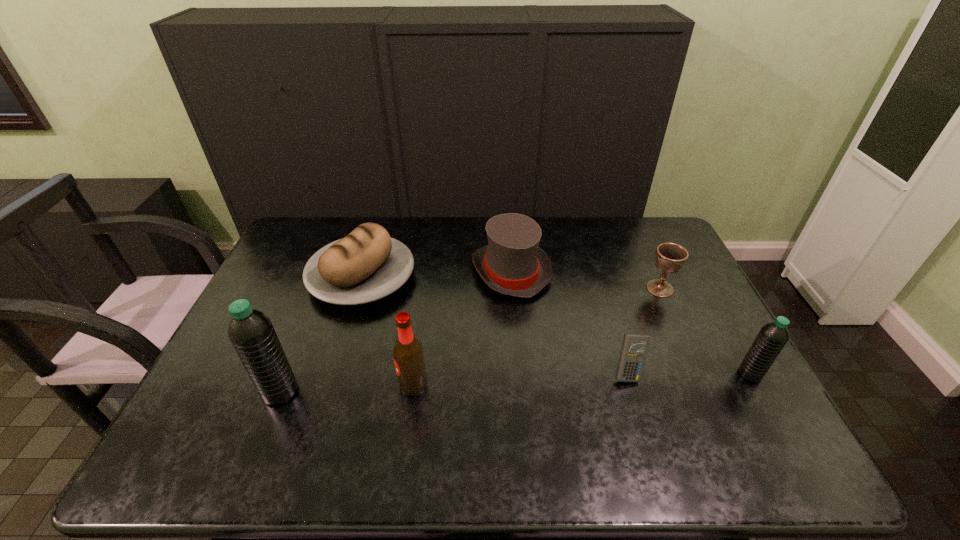
Where is `water bottle that is at the near edge`? Image resolution: width=960 pixels, height=540 pixels. water bottle that is at the near edge is located at coordinates click(251, 332).

Where is `beer bottle at the near edge`? beer bottle at the near edge is located at coordinates pyautogui.click(x=408, y=354).

Where is `water bottle that is positioned at the left edge`? water bottle that is positioned at the left edge is located at coordinates (251, 332).

The height and width of the screenshot is (540, 960). What are the coordinates of `bread present at the left edge` in the screenshot? It's located at (366, 265).

Find the location of a particular element. water bottle that is at the right edge is located at coordinates (773, 336).

You are a GUI agent. You are given a task and a screenshot of the screen. Output one action in this format:
    pyautogui.click(x=<x>, y=<y>)
    Task: Click on the chalice that is positioned at the right edge
    This screenshot has width=960, height=540.
    Given the screenshot: What is the action you would take?
    pyautogui.click(x=670, y=257)

Identify the location of object that is at the far left corner. The height and width of the screenshot is (540, 960). (366, 265).

At what (x,y) coordinates should I click in order to perform the action: click on object present at the near left corner. Please return your answer as a coordinate pair (x, y). The width and height of the screenshot is (960, 540). Looking at the image, I should click on (251, 332).

I want to click on blank space at the far edge of the desktop, so click(x=484, y=230).

Where is `vacant area at the near edge of the desktop`? vacant area at the near edge of the desktop is located at coordinates (695, 409).